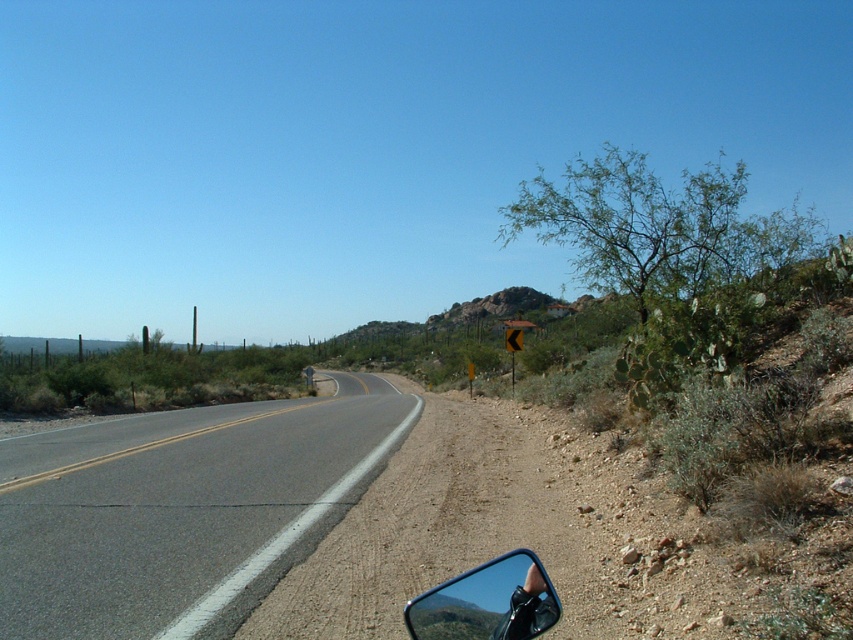
Is dirt road at lower left smaller than black rubber view mirror at lower right?

Incorrect, dirt road at lower left is not smaller in size than black rubber view mirror at lower right.

Which is below, dirt road at lower left or black rubber view mirror at lower right?

Positioned lower is dirt road at lower left.

Who is more forward, (x=386, y=600) or (x=497, y=625)?

Point (x=497, y=625) is in front.

Find the location of a particular element. The width and height of the screenshot is (853, 640). dirt road at lower left is located at coordinates (425, 525).

Where is `asphalt road at left`? This screenshot has height=640, width=853. asphalt road at left is located at coordinates (181, 509).

Consider the image. Is asphalt road at left below dirt road at lower left?

Yes.

Locate an element on the screen. This screenshot has height=640, width=853. asphalt road at left is located at coordinates (181, 509).

Locate an element on the screen. The image size is (853, 640). asphalt road at left is located at coordinates [181, 509].

Which is behind, point (119, 529) or point (527, 628)?

The point (119, 529) is behind.

Who is taller, asphalt road at left or black rubber view mirror at lower right?

With more height is asphalt road at left.

I want to click on asphalt road at left, so click(x=181, y=509).